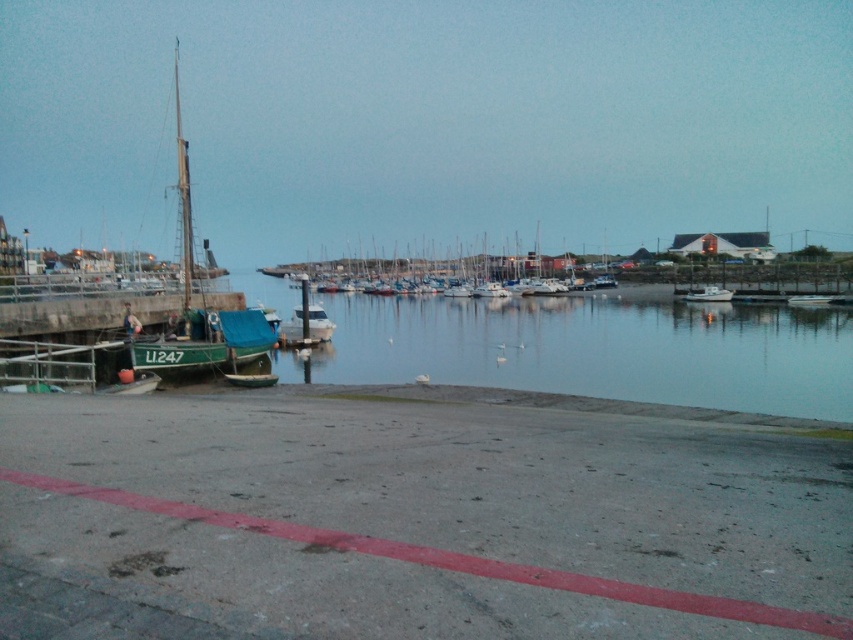
You are navigating a small drone that needs to take a photo of the green matte sailboat at left from above. Given the coordinates provided in the description, can you confirm if the sailboat is positioned closer to the left or right side of the image?

The green matte sailboat at left is located at point (202,308), which places it closer to the left side of the image based on the coordinate system provided.

You are a harbor security officer who needs to ensure that the green matte sailboat at left and the white matte boats at center are within the designated red line area. Based on their sizes, which boat requires more space to maneuver and why?

The green matte sailboat at left requires more space to maneuver because it has a larger size compared to the white matte boats at center.